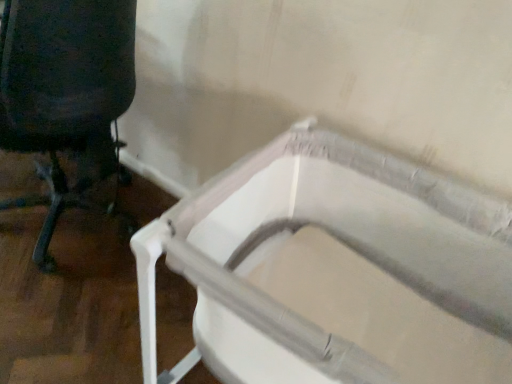
What do you see at coordinates (336, 270) in the screenshot? The height and width of the screenshot is (384, 512). I see `white plastic bath at center` at bounding box center [336, 270].

Find the location of `white plastic bath at center`. white plastic bath at center is located at coordinates (336, 270).

The width and height of the screenshot is (512, 384). What do you see at coordinates (67, 100) in the screenshot?
I see `black fabric chair at left` at bounding box center [67, 100].

Locate an element on the screen. The height and width of the screenshot is (384, 512). black fabric chair at left is located at coordinates (67, 100).

The height and width of the screenshot is (384, 512). Identify the location of white plastic bath at center. (336, 270).

Consider the image. Does black fabric chair at left appear on the left side of white plastic bath at center?

Yes, black fabric chair at left is to the left of white plastic bath at center.

Based on the photo, considering the positions of objects black fabric chair at left and white plastic bath at center in the image provided, who is in front, black fabric chair at left or white plastic bath at center?

white plastic bath at center.

Considering the positions of points (71, 36) and (242, 169), is point (71, 36) farther from camera compared to point (242, 169)?

Yes, it is behind point (242, 169).

From the image's perspective, is black fabric chair at left positioned above or below white plastic bath at center?

From the image's perspective, black fabric chair at left appears above white plastic bath at center.

From a real-world perspective, is black fabric chair at left beneath white plastic bath at center?

No, from a real-world perspective, black fabric chair at left is not beneath white plastic bath at center.

Is black fabric chair at left thinner than white plastic bath at center?

Yes.

Considering the sizes of objects black fabric chair at left and white plastic bath at center in the image provided, who is shorter, black fabric chair at left or white plastic bath at center?

Standing shorter between the two is white plastic bath at center.

Is black fabric chair at left bigger than white plastic bath at center?

Correct, black fabric chair at left is larger in size than white plastic bath at center.

Can we say black fabric chair at left lies outside white plastic bath at center?

Absolutely, black fabric chair at left is external to white plastic bath at center.

Is black fabric chair at left touching white plastic bath at center?

black fabric chair at left and white plastic bath at center are not in contact.

Is black fabric chair at left oriented towards white plastic bath at center?

No, black fabric chair at left is not oriented towards white plastic bath at center.

Can you tell me how much black fabric chair at left and white plastic bath at center differ in facing direction?

They differ by 91 degrees in their facing directions.

Find the location of a particular element. This screenshot has width=512, height=384. bath that is under the black fabric chair at left (from a real-world perspective) is located at coordinates pyautogui.click(x=336, y=270).

Is white plastic bath at center to the left of black fabric chair at left from the viewer's perspective?

No.

Who is more distant, white plastic bath at center or black fabric chair at left?

black fabric chair at left is further away from the camera.

Is point (231, 341) closer or farther from the camera than point (86, 129)?

Point (231, 341) is positioned closer to the camera compared to point (86, 129).

From the image's perspective, which object appears higher, white plastic bath at center or black fabric chair at left?

black fabric chair at left is shown above in the image.

From the picture: From a real-world perspective, which is physically above, white plastic bath at center or black fabric chair at left?

From a 3D spatial view, black fabric chair at left is above.

Can you confirm if white plastic bath at center is thinner than black fabric chair at left?

No.

Who is shorter, white plastic bath at center or black fabric chair at left?

white plastic bath at center.

Can you confirm if white plastic bath at center is smaller than black fabric chair at left?

Yes.

Is white plastic bath at center positioned beyond the bounds of black fabric chair at left?

white plastic bath at center lies outside black fabric chair at left's area.

Is white plastic bath at center far away from black fabric chair at left?

That's not correct — white plastic bath at center is a little close to black fabric chair at left.

Could you tell me if white plastic bath at center is turned towards black fabric chair at left?

No, white plastic bath at center is not aimed at black fabric chair at left.

What's the angular difference between white plastic bath at center and black fabric chair at left's facing directions?

white plastic bath at center and black fabric chair at left are facing 91 degrees away from each other.

Consider the image. Measure the distance between white plastic bath at center and black fabric chair at left.

white plastic bath at center and black fabric chair at left are 29.43 inches apart.

Locate an element on the screen. This screenshot has height=384, width=512. chair behind the white plastic bath at center is located at coordinates (67, 100).

You are a GUI agent. You are given a task and a screenshot of the screen. Output one action in this format:
    pyautogui.click(x=<x>, y=<y>)
    Task: Click on the bath that is on the right side of black fabric chair at left
    This screenshot has height=384, width=512.
    Given the screenshot: What is the action you would take?
    pyautogui.click(x=336, y=270)

I want to click on bath in front of the black fabric chair at left, so click(336, 270).